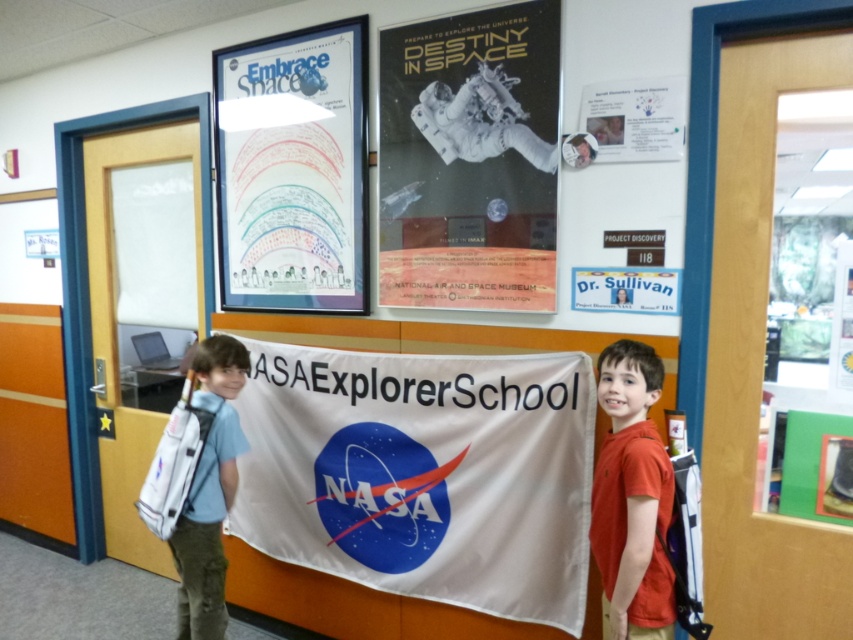
Between point (527, 477) and point (648, 556), which one is positioned behind?

The point (527, 477) is more distant.

Where is `white fabric banner at center`? This screenshot has width=853, height=640. white fabric banner at center is located at coordinates (422, 474).

Locate an element on the screen. white fabric banner at center is located at coordinates (422, 474).

The image size is (853, 640). Identify the location of white fabric banner at center. (422, 474).

From the picture: Can you confirm if white fabric banner at center is wider than light blue fabric backpack at left?

Correct, the width of white fabric banner at center exceeds that of light blue fabric backpack at left.

Image resolution: width=853 pixels, height=640 pixels. I want to click on white fabric banner at center, so click(422, 474).

Find the location of a particular element. This screenshot has width=853, height=640. white fabric banner at center is located at coordinates (422, 474).

Identify the location of matte black poster at upper center. pos(469,160).

Image resolution: width=853 pixels, height=640 pixels. In order to click on matte black poster at upper center in this screenshot , I will do `click(469, 160)`.